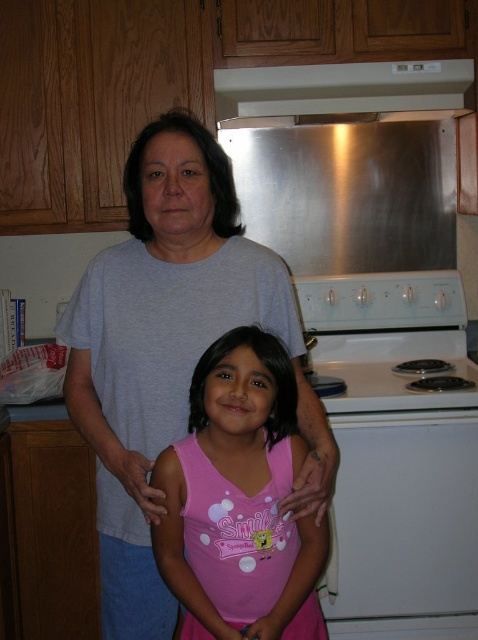
Question: Among these points, which one is farthest from the camera?

Choices:
 (A) (267, 88)
 (B) (283, 372)
 (C) (437, 605)
 (D) (191, 353)

Answer: (A)

Question: Can you confirm if gray cotton shirt at upper center is thinner than pink fabric shirt at center?

Choices:
 (A) yes
 (B) no

Answer: (B)

Question: Which point is farther to the camera?

Choices:
 (A) pink fabric shirt at center
 (B) gray cotton shirt at upper center

Answer: (B)

Question: Which of the following is the closest to the observer?

Choices:
 (A) (423, 404)
 (B) (470, 61)
 (C) (405, 618)

Answer: (A)

Question: Is the position of pink fabric shirt at center less distant than that of stainless steel exhaust hood at upper center?

Choices:
 (A) yes
 (B) no

Answer: (A)

Question: Does gray cotton shirt at upper center appear under pink fabric shirt at center?

Choices:
 (A) yes
 (B) no

Answer: (B)